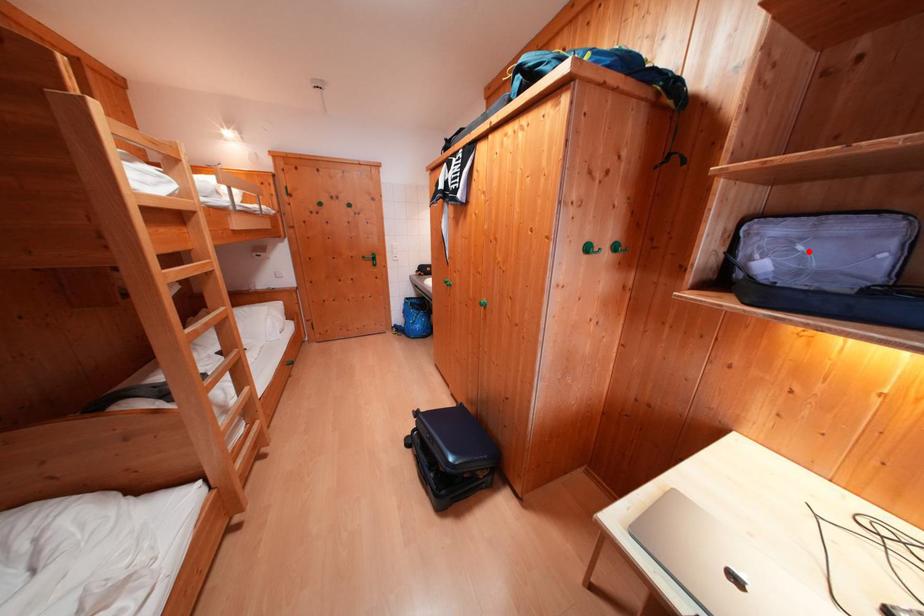
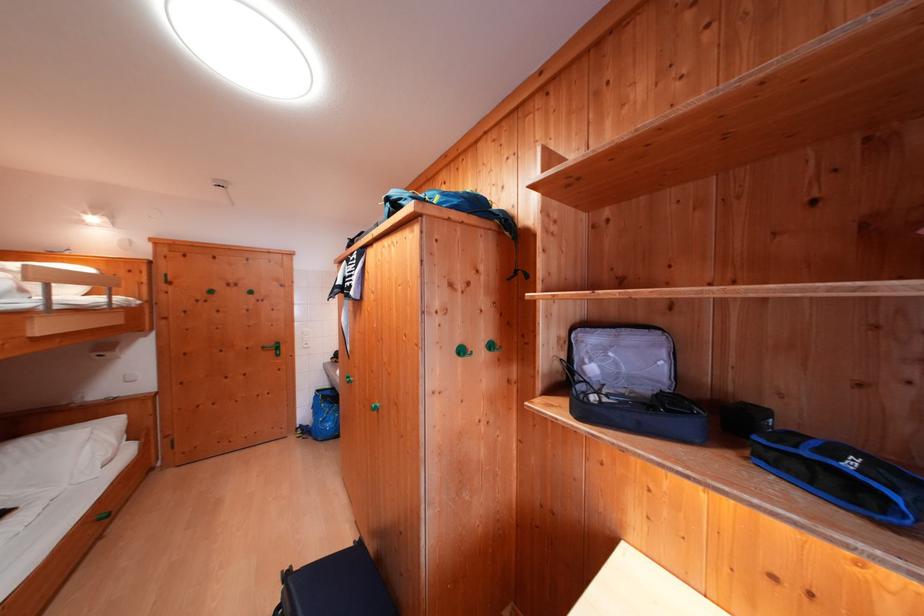
Where in the second image is the point corresponding to the highlighted location from the first image?

(619, 359)